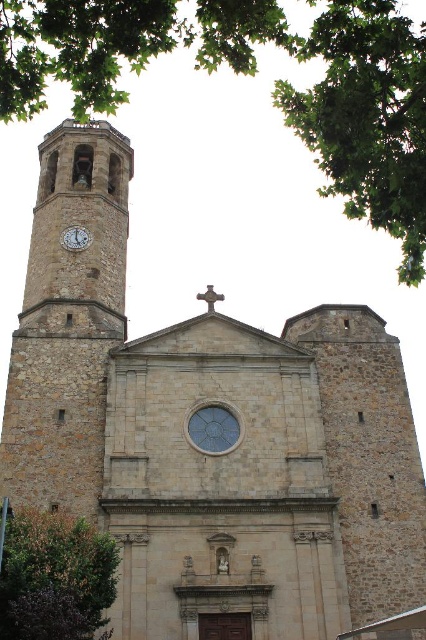
Question: Which point is closer to the camera?

Choices:
 (A) (11, 497)
 (B) (63, 230)

Answer: (A)

Question: Which point is closer to the camera?

Choices:
 (A) (74, 346)
 (B) (68, 237)
 (C) (417, 256)

Answer: (C)

Question: Can you confirm if stone clock tower at left is wider than metallic clock at upper left?

Choices:
 (A) no
 (B) yes

Answer: (B)

Question: In this image, where is stone clock tower at left located relative to metallic clock at upper left?

Choices:
 (A) right
 (B) left

Answer: (B)

Question: Is green leafy tree at upper left wider than metallic clock at upper left?

Choices:
 (A) no
 (B) yes

Answer: (B)

Question: Based on their relative distances, which object is farther from the green leafy tree at upper left?

Choices:
 (A) metallic clock at upper left
 (B) green leafy tree at lower left

Answer: (B)